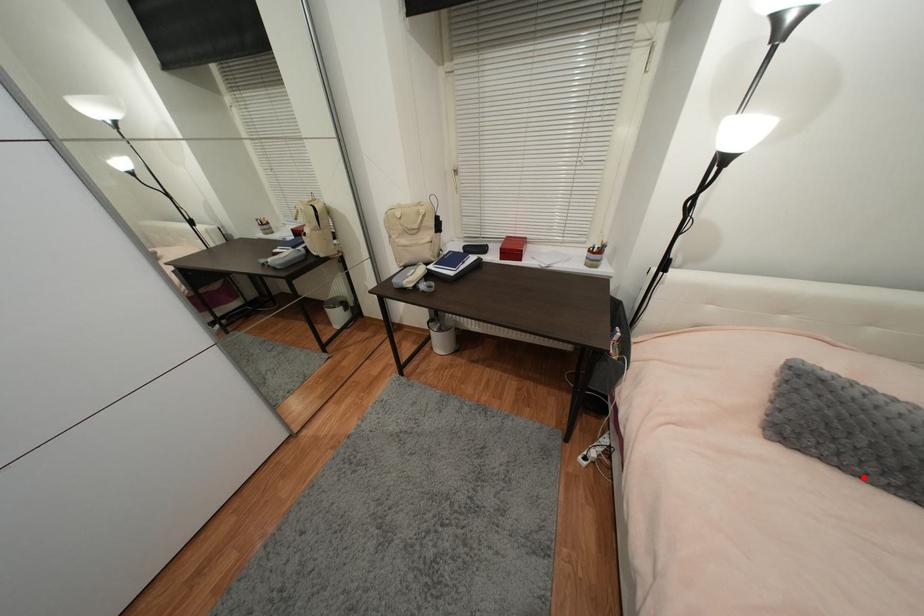
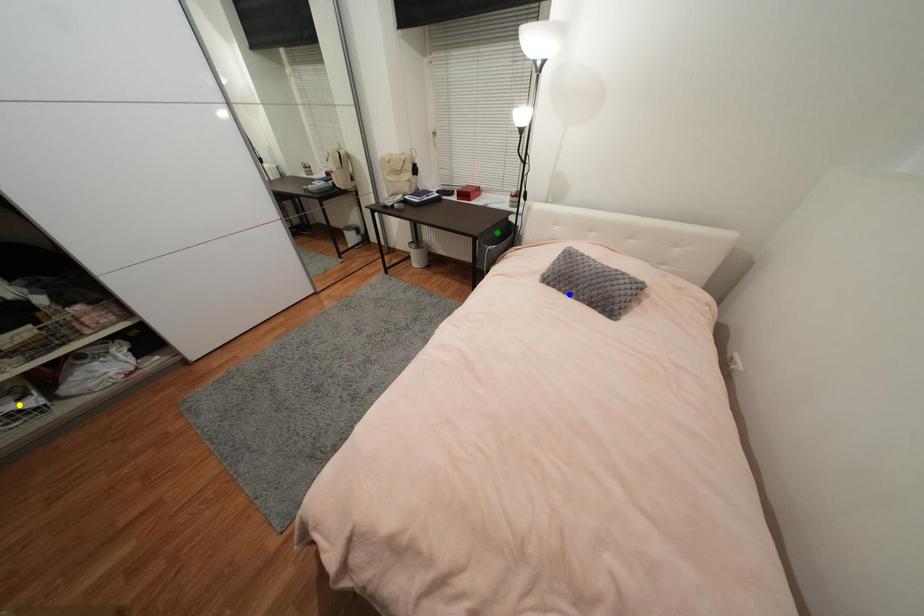
Question: I am providing you with two images of the same scene from different viewpoints. A red point is marked on the first image. You are given multiple points on the second image. Which spot in image 2 lines up with the point in image 1?

Choices:
 (A) blue point
 (B) yellow point
 (C) green point

Answer: (A)